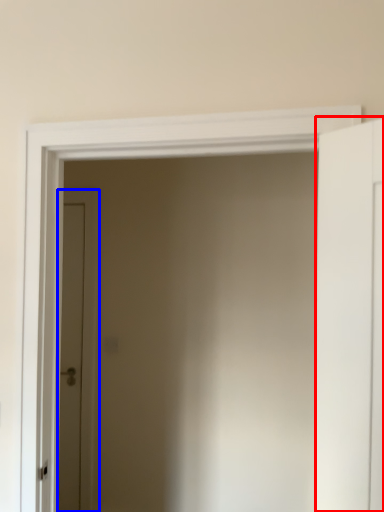
Question: Among these objects, which one is nearest to the camera, door (highlighted by a red box) or door (highlighted by a blue box)?

Choices:
 (A) door
 (B) door

Answer: (A)